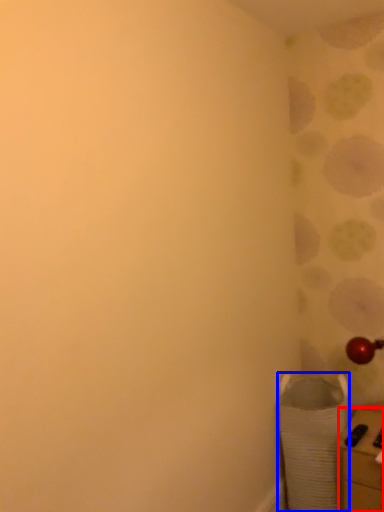
Question: Which object appears closest to the camera in this image, furniture (highlighted by a red box) or laundry basket (highlighted by a blue box)?

Choices:
 (A) furniture
 (B) laundry basket

Answer: (A)